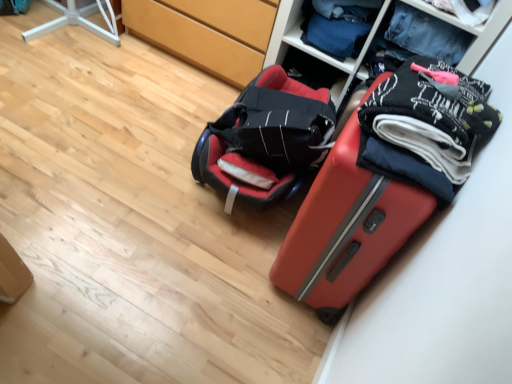
You are a GUI agent. You are given a task and a screenshot of the screen. Output one action in this format:
    pyautogui.click(x=<x>, y=<y>)
    Task: Click on the vacant space situated on the left part of matte red suitcase at lower right
    
    Given the screenshot: What is the action you would take?
    pyautogui.click(x=221, y=255)